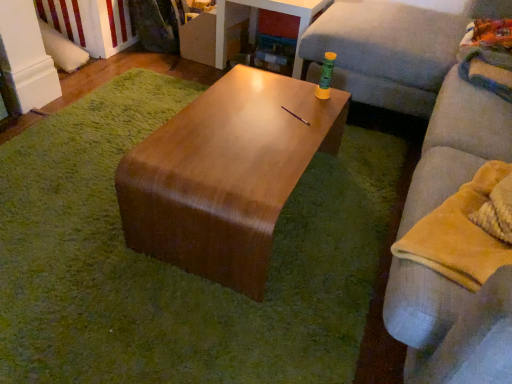
Question: Is point (509, 145) closer or farther from the camera than point (438, 253)?

Choices:
 (A) farther
 (B) closer

Answer: (A)

Question: In terms of width, does light gray fabric couch at right look wider or thinner when compared to yellow fleece blanket at right?

Choices:
 (A) thin
 (B) wide

Answer: (B)

Question: Which of these objects is positioned closest to the shiny brown coffee table at center?

Choices:
 (A) yellow fleece blanket at right
 (B) light gray fabric couch at right
 (C) wooden table at center
 (D) wooden table at center

Answer: (D)

Question: Estimate the real-world distances between objects in this image. Which object is farther from the light gray fabric couch at right?

Choices:
 (A) wooden table at center
 (B) shiny brown coffee table at center
 (C) yellow fleece blanket at right
 (D) wooden table at center

Answer: (D)